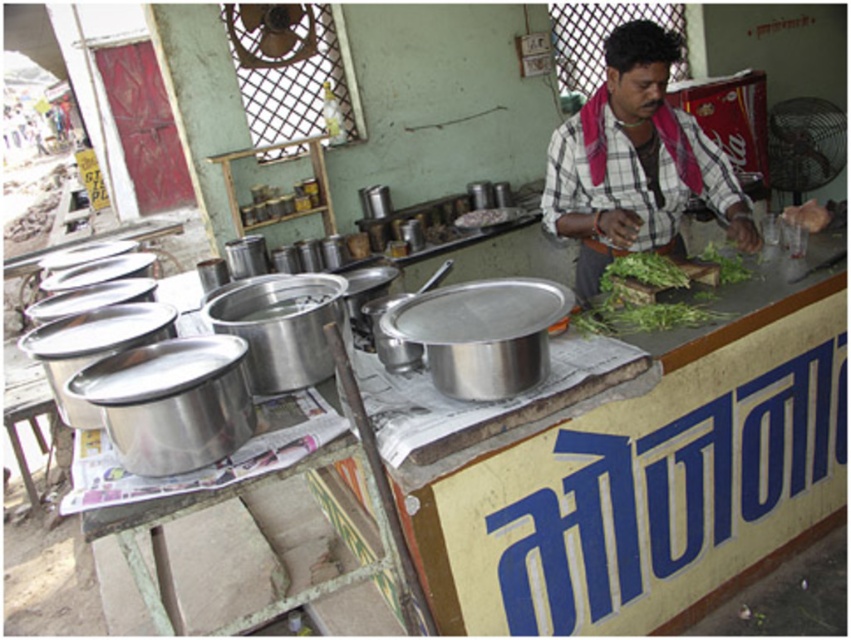
You are a customer at the street food stall and want to know what the vendor is wearing. Which object is closer to you, the white checkered shirt at upper right or the green leafy vegetable at center?

The white checkered shirt at upper right is positioned over the green leafy vegetable at center, so the white checkered shirt at upper right is closer to you.

You are standing at the camera position and want to hand the vendor a 1.5 meter long stick. Can you reach the white checkered shirt at upper right without moving?

The distance between you and the white checkered shirt at upper right is 2.28 meters, which is greater than the 1.5 meter stick. Therefore, you cannot reach the vendor with the stick without moving closer.